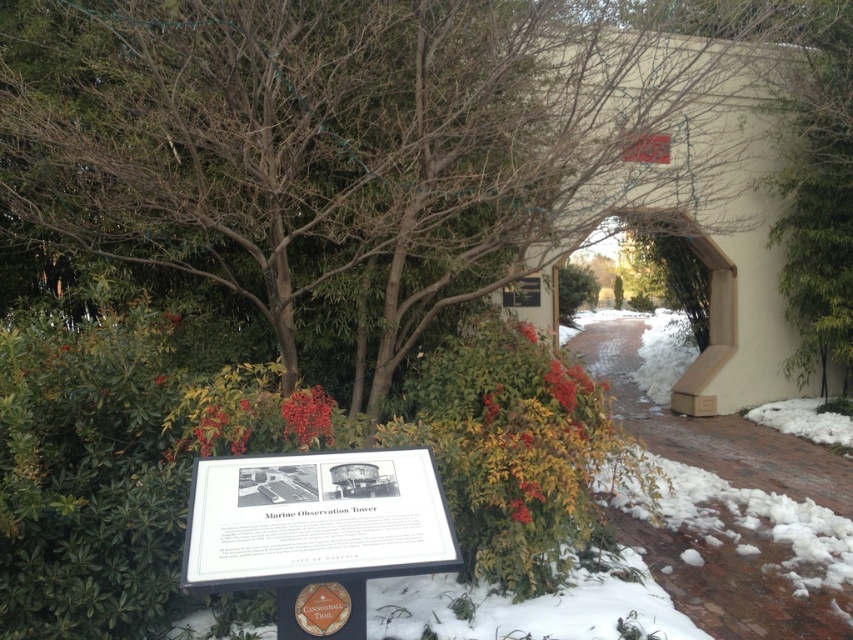
You are standing on the brick at center and want to hide from someone watching from the signboard on the left. Can the brown leafy tree at center block your view?

The brown leafy tree at center is positioned over brick at center, so yes, the tree can block your view from the signboard on the left.

You are standing at the entrance of the Marine Observation Tower and want to place a 15 feet long banner between the brown leafy tree at center and the brick at center. Is there enough space to stretch the banner fully without bending it?

The brown leafy tree at center and brick at center are 17.32 feet apart, so yes, the banner can be stretched fully since the distance between them is greater than the banner length of 15 feet.

You are a construction worker tasked with replacing the brick at center and the white plastic sign at center. If you have a tool that can only handle objects wider than 10 inches, which object should you prioritize replacing first?

The brick at center has a larger width than the white plastic sign at center, so you should prioritize replacing the brick at center first since it is wider and may require more attention before the tool reaches its limit.